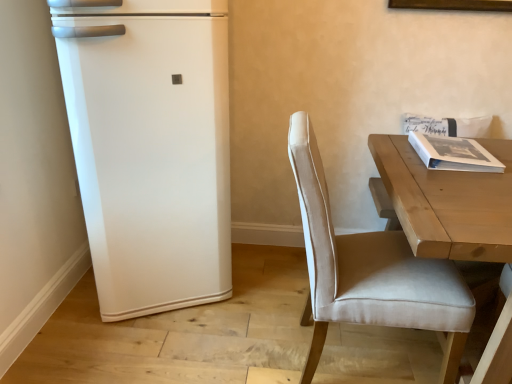
This screenshot has height=384, width=512. Identify the location of vacant region in front of white matte refrigerator at left. (140, 342).